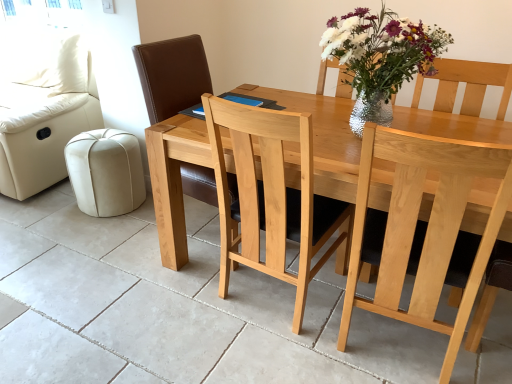
This screenshot has height=384, width=512. I want to click on free space between light wood chair at center, the 2th chair in the left-to-right sequence, and natural wood table at center, so click(x=264, y=319).